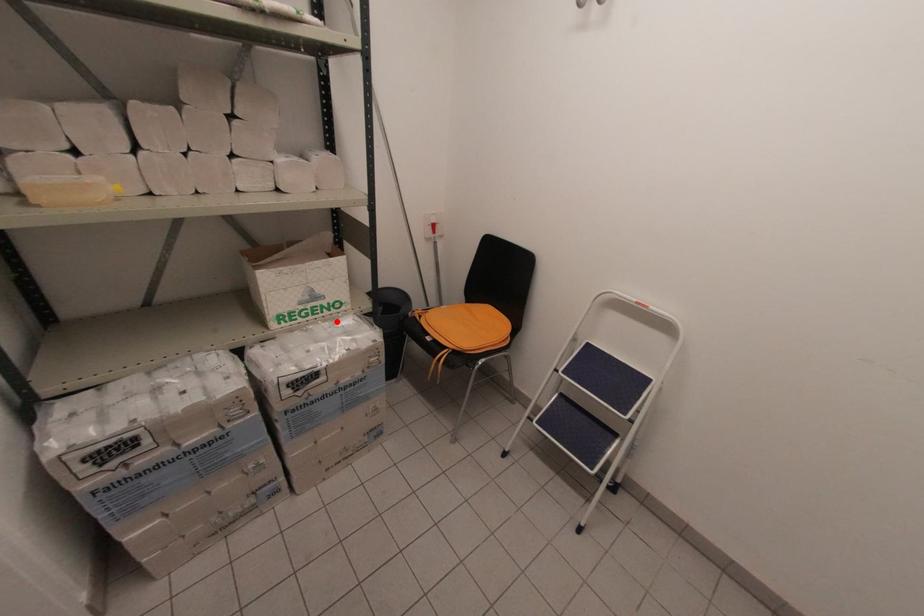
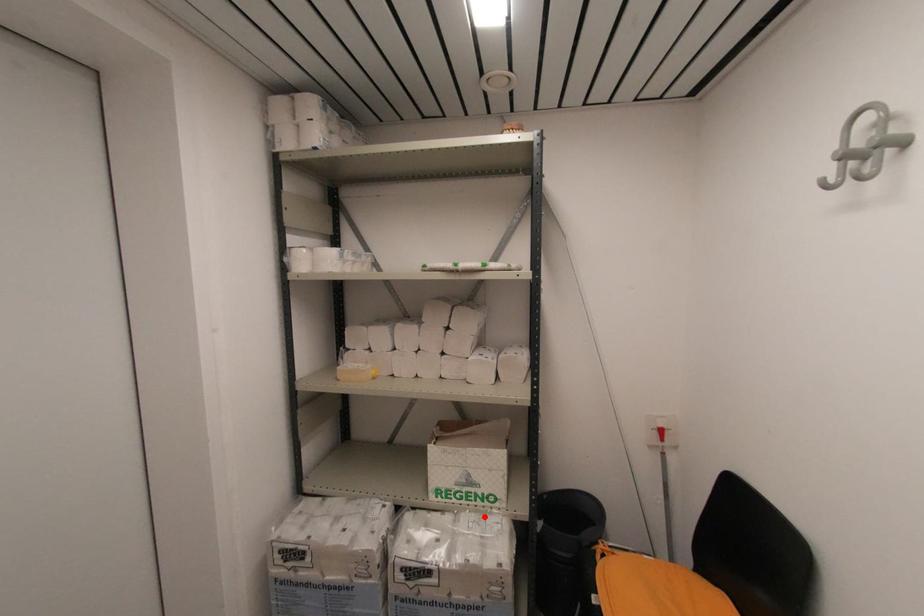
I am providing you with two images of the same scene from different viewpoints. A red point is marked on the first image and another point is marked on the second image. Does the point marked in image1 correspond to the same location as the one in image2?

Yes